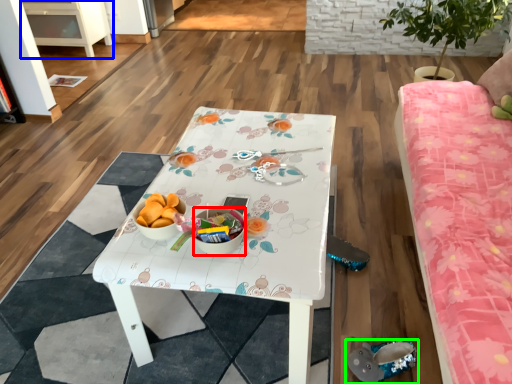
Question: Estimate the real-world distances between objects in this image. Which object is closer to glass bowl (highlighted by a red box), cabinetry (highlighted by a blue box) or footwear (highlighted by a green box)?

Choices:
 (A) cabinetry
 (B) footwear

Answer: (B)